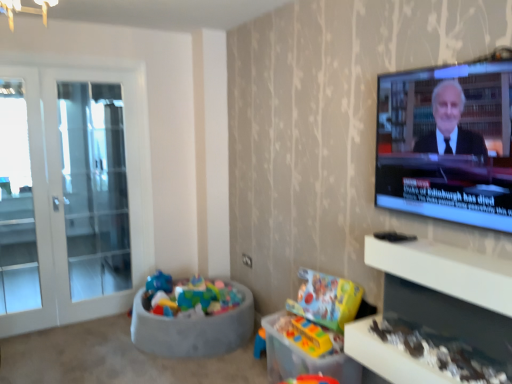
Question: Does white glossy entertainment center at lower right appear on the right side of matte black tv at upper right?

Choices:
 (A) yes
 (B) no

Answer: (B)

Question: From the image's perspective, is white glossy entertainment center at lower right above matte black tv at upper right?

Choices:
 (A) yes
 (B) no

Answer: (B)

Question: Is white glossy entertainment center at lower right not near matte black tv at upper right?

Choices:
 (A) yes
 (B) no

Answer: (B)

Question: Does white glossy entertainment center at lower right have a larger size compared to matte black tv at upper right?

Choices:
 (A) no
 (B) yes

Answer: (B)

Question: From a real-world perspective, is white glossy entertainment center at lower right beneath matte black tv at upper right?

Choices:
 (A) yes
 (B) no

Answer: (A)

Question: Is white glossy entertainment center at lower right thinner than matte black tv at upper right?

Choices:
 (A) no
 (B) yes

Answer: (A)

Question: From a real-world perspective, is white glass door at left located higher than multicolored fabric bean bag at lower left?

Choices:
 (A) yes
 (B) no

Answer: (A)

Question: From the image's perspective, is white glass door at left below multicolored fabric bean bag at lower left?

Choices:
 (A) yes
 (B) no

Answer: (B)

Question: Is white glass door at left at the left side of multicolored fabric bean bag at lower left?

Choices:
 (A) no
 (B) yes

Answer: (B)

Question: Does white glass door at left have a smaller size compared to multicolored fabric bean bag at lower left?

Choices:
 (A) no
 (B) yes

Answer: (A)

Question: Could you tell me if white glass door at left is turned towards multicolored fabric bean bag at lower left?

Choices:
 (A) no
 (B) yes

Answer: (A)

Question: From a real-world perspective, is white glass door at left positioned under multicolored fabric bean bag at lower left based on gravity?

Choices:
 (A) yes
 (B) no

Answer: (B)

Question: Is white glass door at left behind white glossy entertainment center at lower right?

Choices:
 (A) yes
 (B) no

Answer: (A)